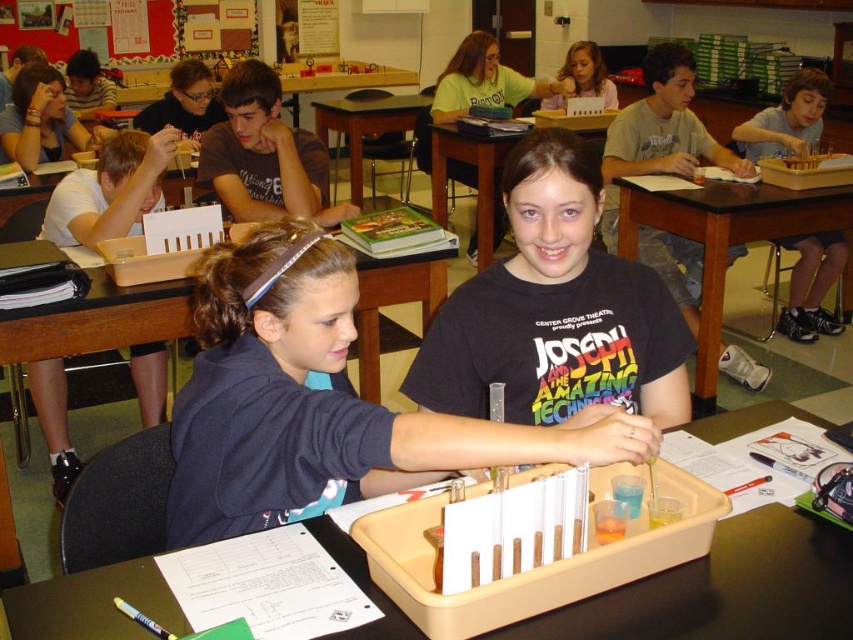
Question: Considering the relative positions of black matte shirt at center and white matte paper at left in the image provided, where is black matte shirt at center located with respect to white matte paper at left?

Choices:
 (A) above
 (B) below

Answer: (B)

Question: Does translucent plastic test tubes at center appear over brown wooden table at center?

Choices:
 (A) no
 (B) yes

Answer: (A)

Question: Can you confirm if translucent plastic tray at center is bigger than brown cotton shirt at upper center?

Choices:
 (A) no
 (B) yes

Answer: (A)

Question: Which object appears closest to the camera in this image?

Choices:
 (A) dark blue fabric shirt at center
 (B) translucent plastic test tubes at center

Answer: (A)

Question: Which of the following is the farthest from the observer?

Choices:
 (A) translucent plastic tray at center
 (B) brown wooden table at center

Answer: (B)

Question: Which object is closer to the camera taking this photo?

Choices:
 (A) white matte paper at left
 (B) dark blue fabric shirt at center
 (C) brown cotton shirt at upper center
 (D) black plastic table at center

Answer: (B)